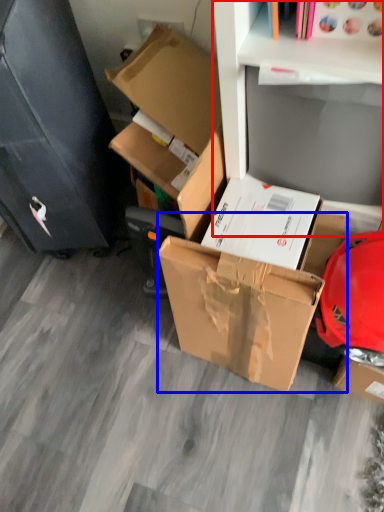
Question: Which of the following is the closest to the observer, shelf (highlighted by a red box) or box (highlighted by a blue box)?

Choices:
 (A) shelf
 (B) box

Answer: (A)